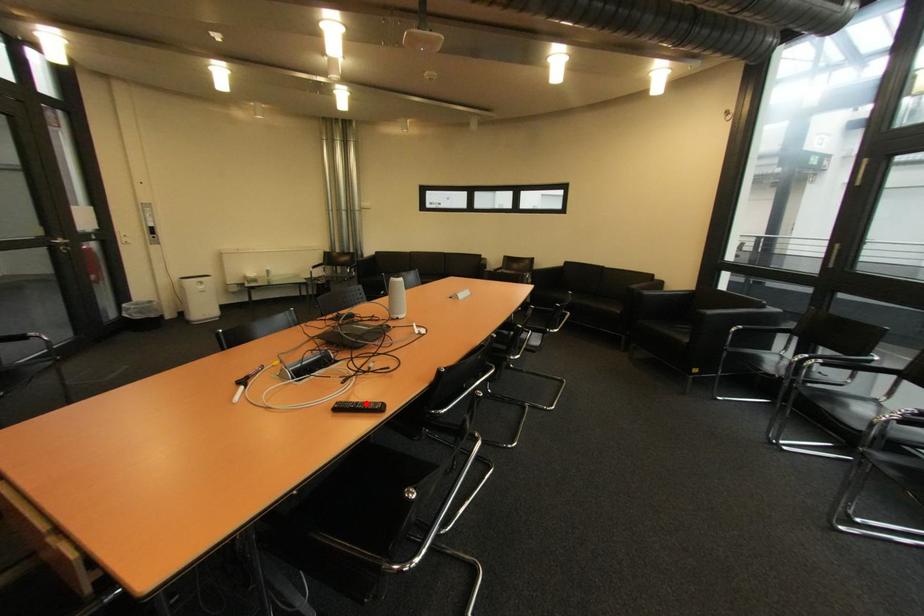
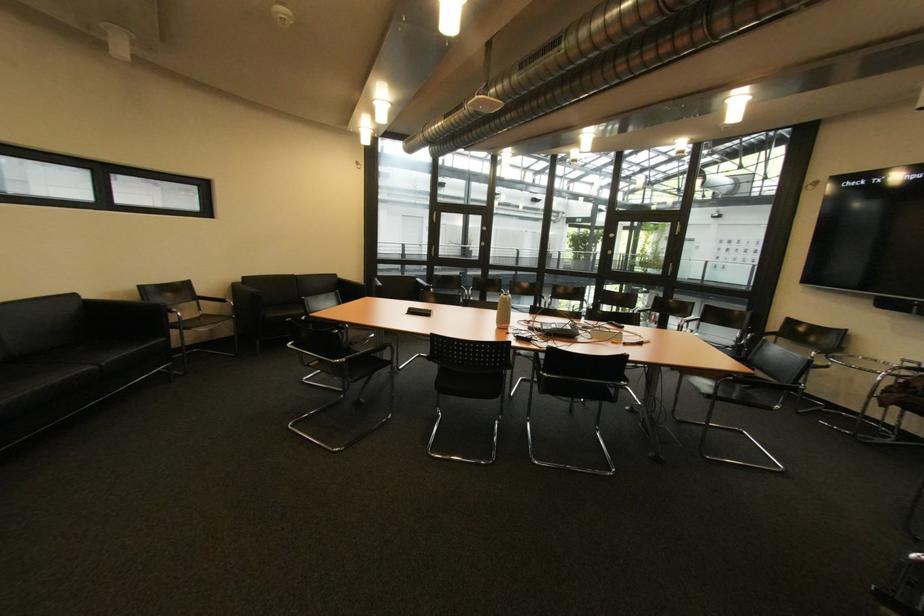
Question: I am providing you with two images of the same scene from different viewpoints. A red point is marked on the first image. At the location where the point appears in image 1, is it still visible in image 2?

Choices:
 (A) Yes
 (B) No

Answer: (B)